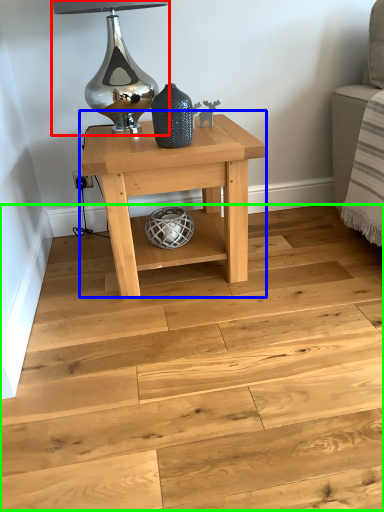
Question: Which object is positioned farthest from table lamp (highlighted by a red box)? Select from table (highlighted by a blue box) and stair (highlighted by a green box).

Choices:
 (A) table
 (B) stair

Answer: (B)